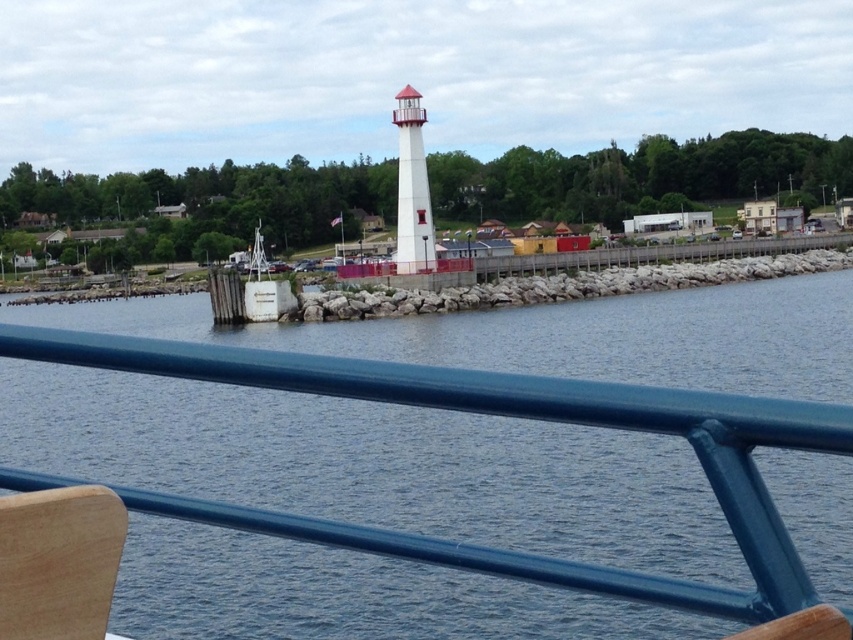
Question: Can you confirm if blue water at center is wider than wooden chair at lower left?

Choices:
 (A) no
 (B) yes

Answer: (B)

Question: Which point is farther to the camera?

Choices:
 (A) (605, 301)
 (B) (51, 604)

Answer: (A)

Question: Which point appears closest to the camera in this image?

Choices:
 (A) (202, 388)
 (B) (15, 532)

Answer: (B)

Question: Can you confirm if blue water at center is positioned below wooden chair at lower left?

Choices:
 (A) no
 (B) yes

Answer: (A)

Question: Does blue water at center come behind wooden chair at lower left?

Choices:
 (A) yes
 (B) no

Answer: (A)